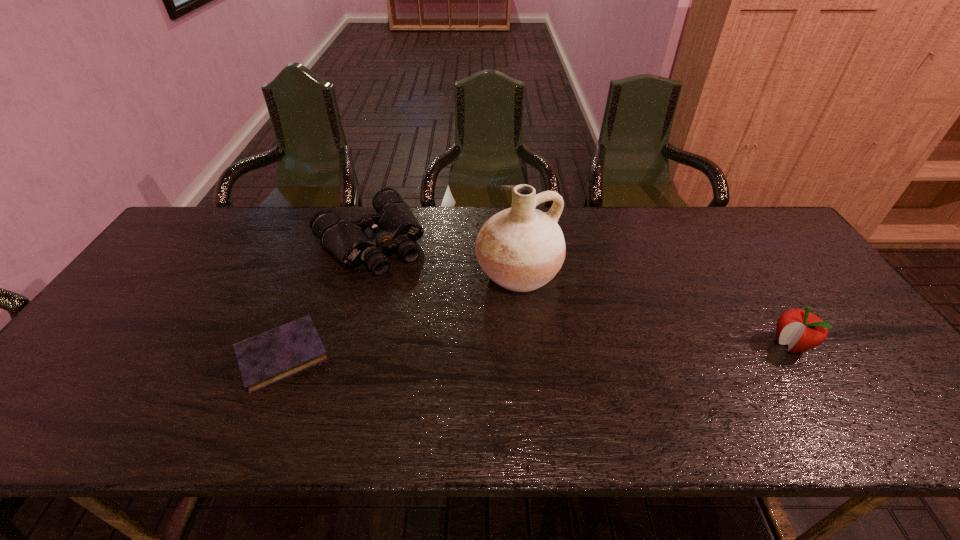
Identify the location of vacant area that lies between the diary and the third tallest object. (326, 298).

You are a GUI agent. You are given a task and a screenshot of the screen. Output one action in this format:
    pyautogui.click(x=<x>, y=<y>)
    Task: Click on the free space that is in between the diary and the apple
    This screenshot has width=960, height=540.
    Given the screenshot: What is the action you would take?
    pyautogui.click(x=537, y=350)

Find the location of a particular element. unoccupied area between the second shortest object and the diary is located at coordinates (326, 298).

Identify which object is the second nearest to the shortest object. Please provide its 2D coordinates. Your answer should be formatted as a tuple, i.e. [(x, y)], where the tuple contains the x and y coordinates of a point satisfying the conditions above.

[(521, 248)]

Identify which object is the third nearest to the second shortest object. Please provide its 2D coordinates. Your answer should be formatted as a tuple, i.e. [(x, y)], where the tuple contains the x and y coordinates of a point satisfying the conditions above.

[(802, 330)]

At what (x,y) coordinates should I click in order to perform the action: click on vacant space that satisfies the following two spatial constraints: 1. on the back side of the binoculars; 2. on the left side of the diary. Please return your answer as a coordinate pair (x, y). The height and width of the screenshot is (540, 960). Looking at the image, I should click on (328, 240).